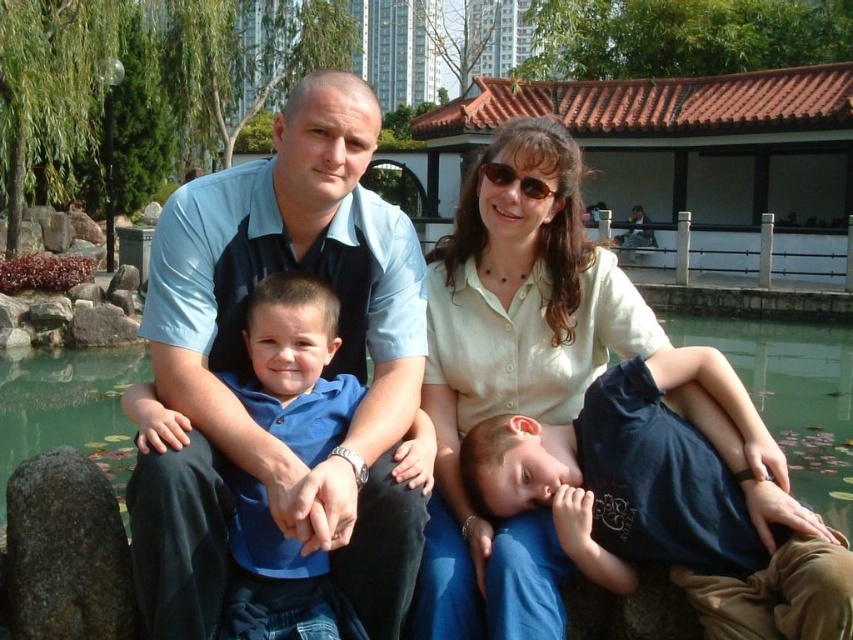
You are a photographer standing at the edge of the pond. You want to take a photo of the blue shirt at center and the gray rough stone at lower left. Which object is closer to the right side of the photo frame?

The blue shirt at center is positioned on the right side of gray rough stone at lower left, so the blue shirt at center is closer to the right side of the photo frame.